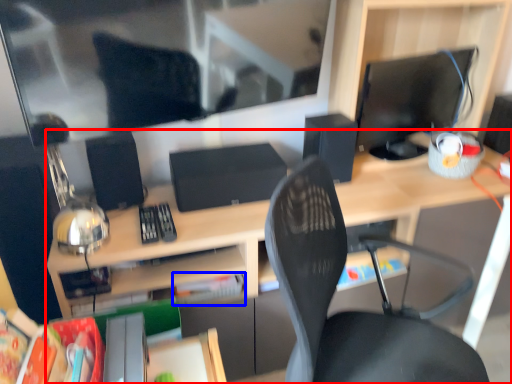
Question: Among these objects, which one is farthest to the camera, desk (highlighted by a red box) or paperback book (highlighted by a blue box)?

Choices:
 (A) desk
 (B) paperback book

Answer: (B)